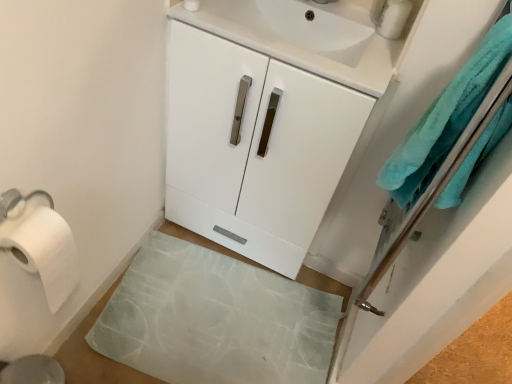
The height and width of the screenshot is (384, 512). Identify the location of vacant space situated on the left part of metallic silver soap dispenser at upper right. (347, 19).